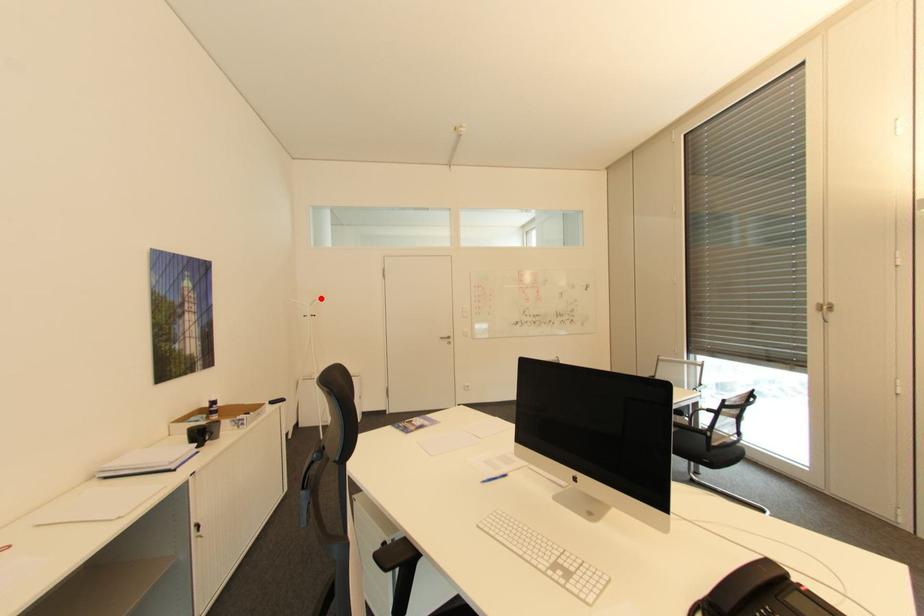
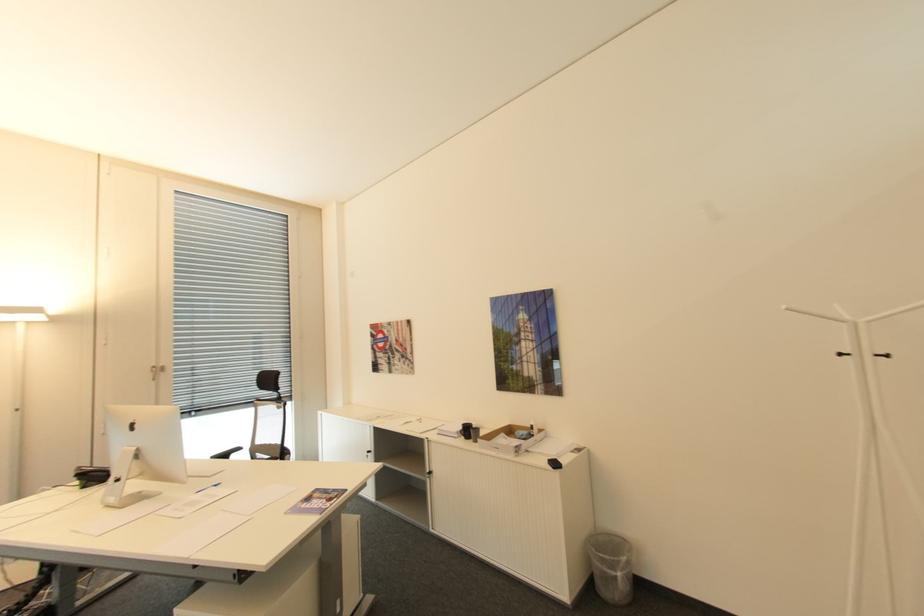
Find the pixel in the second image that matches the highlighted location in the first image.

(791, 307)